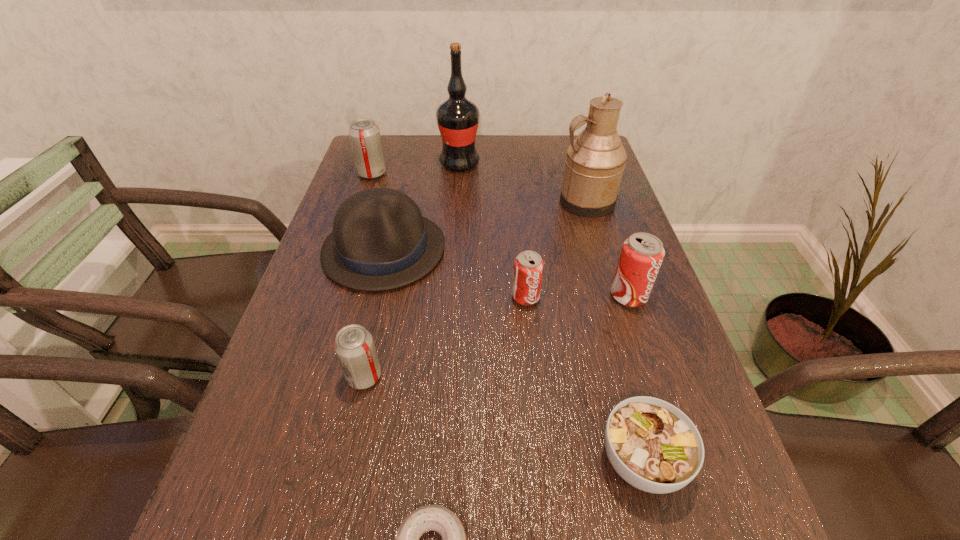
Find the location of a particular element. This screenshot has width=960, height=540. wine bottle is located at coordinates (457, 118).

Locate an element on the screen. The image size is (960, 540). the second tallest object is located at coordinates (595, 160).

Find the location of a particular element. The height and width of the screenshot is (540, 960). the bigger gray soda can is located at coordinates (364, 134).

Locate an element on the screen. the left gray soda can is located at coordinates (364, 134).

Locate an element on the screen. the bigger pink soda can is located at coordinates (642, 254).

Locate an element on the screen. This screenshot has width=960, height=540. the rightmost soda can is located at coordinates (642, 254).

The width and height of the screenshot is (960, 540). I want to click on bowler hat, so click(x=380, y=241).

The height and width of the screenshot is (540, 960). I want to click on the left pink soda can, so click(x=528, y=265).

This screenshot has height=540, width=960. In order to click on the second soda can from right to left in this screenshot , I will do `click(528, 265)`.

You are a GUI agent. You are given a task and a screenshot of the screen. Output one action in this format:
    pyautogui.click(x=<x>, y=<y>)
    Task: Click on the nearer gray soda can
    Image resolution: width=960 pixels, height=540 pixels.
    Given the screenshot: What is the action you would take?
    pos(354,346)